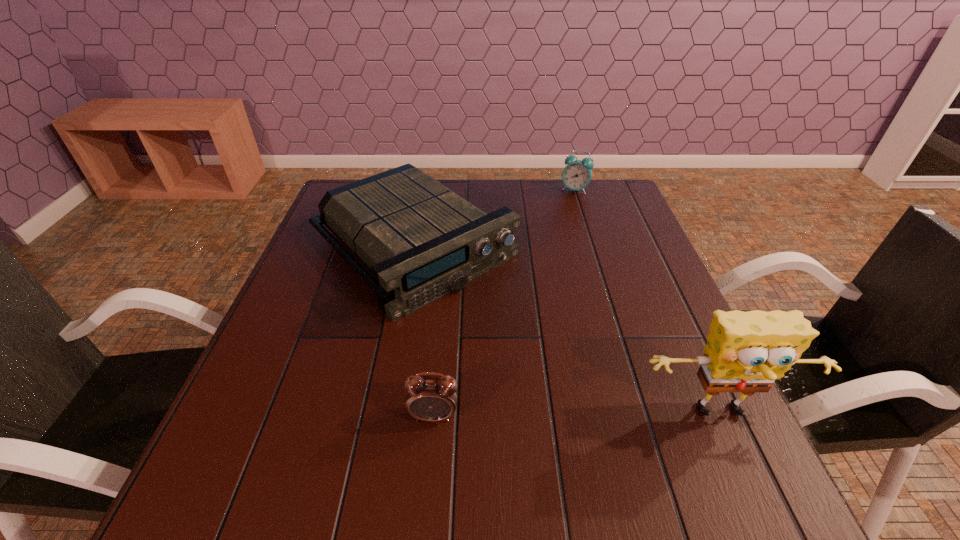
Where is `vacant area between the left alarm clock and the tallest object`? The width and height of the screenshot is (960, 540). vacant area between the left alarm clock and the tallest object is located at coordinates (578, 415).

The image size is (960, 540). Find the location of `unoccupied area between the left alarm clock and the radio receiver`. unoccupied area between the left alarm clock and the radio receiver is located at coordinates (423, 330).

The height and width of the screenshot is (540, 960). What are the coordinates of `vacant space that's between the right alarm clock and the nearer alarm clock` in the screenshot? It's located at (504, 302).

Find the location of `object identified as the closest to the sponge`. object identified as the closest to the sponge is located at coordinates (420, 240).

Locate which object is the closest to the sponge. Please provide its 2D coordinates. Your answer should be formatted as a tuple, i.e. [(x, y)], where the tuple contains the x and y coordinates of a point satisfying the conditions above.

[(420, 240)]

Image resolution: width=960 pixels, height=540 pixels. Find the location of `vacant space that satisfies the following two spatial constraints: 1. on the back side of the radio receiver; 2. on the right side of the right alarm clock`. vacant space that satisfies the following two spatial constraints: 1. on the back side of the radio receiver; 2. on the right side of the right alarm clock is located at coordinates (424, 190).